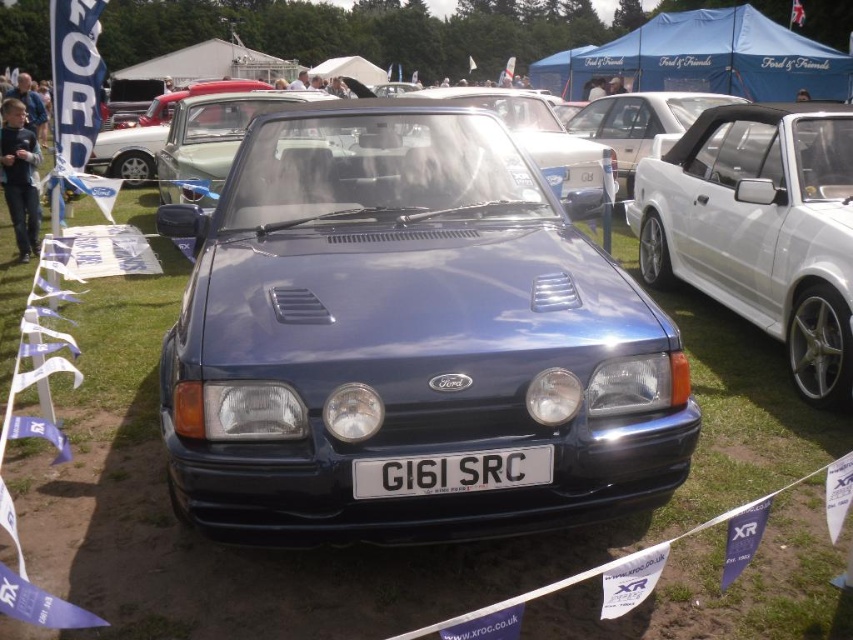
Question: Does white metallic sedan at right have a larger size compared to black plastic license plate at center?

Choices:
 (A) yes
 (B) no

Answer: (A)

Question: Which point is closer to the camera?

Choices:
 (A) white metallic sedan at right
 (B) glossy blue car at center
 (C) black plastic license plate at center

Answer: (C)

Question: Which object appears closest to the camera in this image?

Choices:
 (A) glossy blue car at center
 (B) black plastic license plate at center
 (C) white metallic sedan at right

Answer: (B)

Question: Does glossy blue car at center appear on the right side of white metallic sedan at right?

Choices:
 (A) yes
 (B) no

Answer: (B)

Question: Which object is closer to the camera taking this photo?

Choices:
 (A) glossy blue car at center
 (B) black plastic license plate at center
 (C) white metallic sedan at right

Answer: (B)

Question: Is glossy blue car at center behind white metallic sedan at right?

Choices:
 (A) no
 (B) yes

Answer: (A)